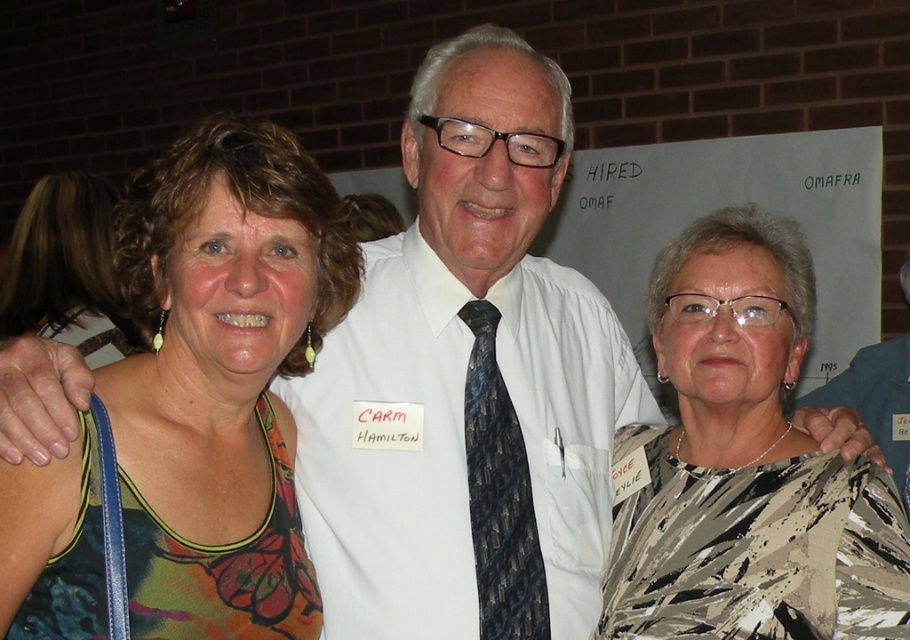
The height and width of the screenshot is (640, 910). What are the coordinates of `multicolored fabric top at center` in the screenshot? It's located at (221, 378).

Is point (239, 500) more distant than point (93, 298)?

No, (239, 500) is in front of (93, 298).

Where is `multicolored fabric top at center`? This screenshot has height=640, width=910. multicolored fabric top at center is located at coordinates (221, 378).

Does printed silk blouse at center have a lesser width compared to multicolored fabric at left?

Yes.

Between point (675, 272) and point (73, 262), which one is positioned behind?

Point (73, 262)

Between point (651, 556) and point (105, 301), which one is positioned behind?

Point (105, 301)

Identify the location of printed silk blouse at center. (744, 465).

Does multicolored fabric top at center have a larger size compared to printed silk blouse at center?

Incorrect, multicolored fabric top at center is not larger than printed silk blouse at center.

Describe the element at coordinates (221, 378) in the screenshot. The height and width of the screenshot is (640, 910). I see `multicolored fabric top at center` at that location.

Where is `multicolored fabric top at center`? multicolored fabric top at center is located at coordinates (221, 378).